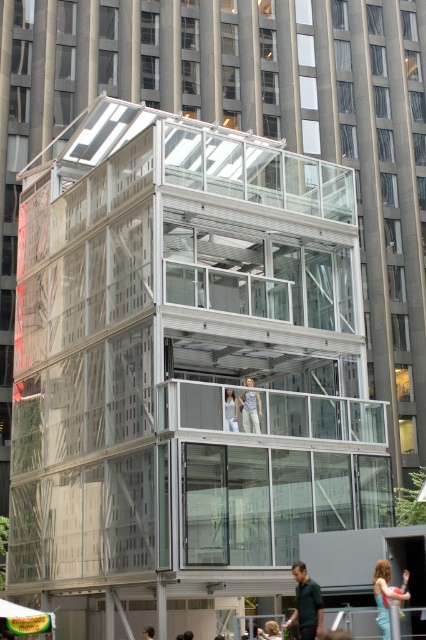
Question: Can you confirm if light brown hair at center is thinner than smooth skin person at center?

Choices:
 (A) yes
 (B) no

Answer: (B)

Question: Is light brown hair at center below light blue jeans at center?

Choices:
 (A) no
 (B) yes

Answer: (B)

Question: From the image, what is the correct spatial relationship of transparent glass building at center in relation to light beige fabric pants at center?

Choices:
 (A) above
 (B) below

Answer: (A)

Question: Which point appears closest to the camera in this image?

Choices:
 (A) (267, 627)
 (B) (226, 422)

Answer: (A)

Question: Considering the real-world distances, which object is closest to the light blue jeans at center?

Choices:
 (A) light brown leather jacket at center
 (B) smooth skin person at center
 (C) light beige fabric pants at center

Answer: (C)

Question: Among these points, which one is farthest from the camera?

Choices:
 (A) (187, 632)
 (B) (146, 628)
 (C) (299, 602)
 (D) (279, 630)

Answer: (A)